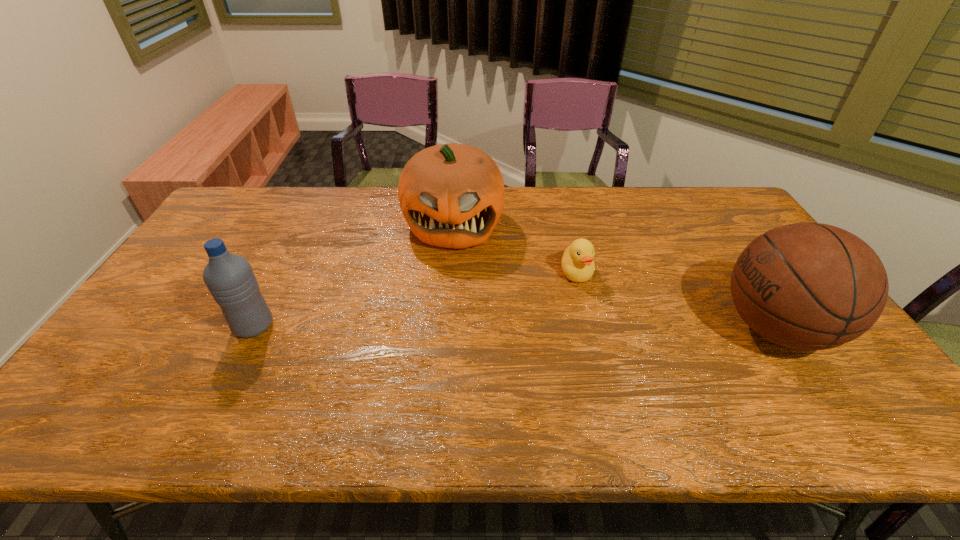
This screenshot has width=960, height=540. I want to click on free space between the duckling and the third object from right to left, so click(515, 248).

I want to click on vacant area between the farthest object and the leftmost object, so click(353, 275).

The height and width of the screenshot is (540, 960). Find the location of `unoccupied area between the rightmost object and the farthest object`. unoccupied area between the rightmost object and the farthest object is located at coordinates (614, 276).

Where is `free spot between the basketball and the third object from left to right`? free spot between the basketball and the third object from left to right is located at coordinates (676, 300).

Choose which object is the nearest neighbor to the duckling. Please provide its 2D coordinates. Your answer should be formatted as a tuple, i.e. [(x, y)], where the tuple contains the x and y coordinates of a point satisfying the conditions above.

[(451, 195)]

Identify the location of object that ranks as the second closest to the basketball. (451, 195).

This screenshot has height=540, width=960. Identify the location of vacant space that satisfies the following two spatial constraints: 1. on the back side of the water bottle; 2. on the left side of the third object from right to left. 305,224.

The width and height of the screenshot is (960, 540). I want to click on free spot that satisfies the following two spatial constraints: 1. on the front side of the shortest object; 2. on the side with brand label of the rightmost object, so click(590, 328).

Image resolution: width=960 pixels, height=540 pixels. I want to click on free point that satisfies the following two spatial constraints: 1. on the front side of the third object from right to left; 2. on the side with brand label of the basketball, so click(445, 328).